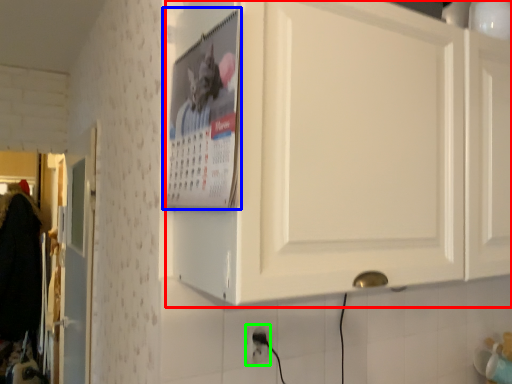
Question: Considering the real-world distances, which object is closest to cabinetry (highlighted by a red box)? poster page (highlighted by a blue box) or electric outlet (highlighted by a green box).

Choices:
 (A) poster page
 (B) electric outlet

Answer: (A)